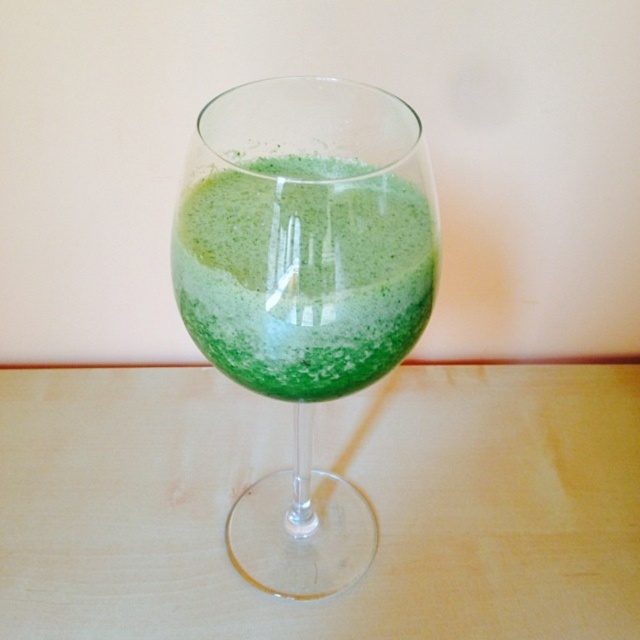
Question: Can you confirm if green glass at center is wider than green frothy liquid at center?

Choices:
 (A) yes
 (B) no

Answer: (A)

Question: Is green translucent wine glass at center thinner than green frothy liquid at center?

Choices:
 (A) no
 (B) yes

Answer: (A)

Question: Does green glass at center appear over green translucent wine glass at center?

Choices:
 (A) yes
 (B) no

Answer: (B)

Question: Which object is positioned farthest from the green frothy liquid at center?

Choices:
 (A) green glass at center
 (B) green translucent wine glass at center

Answer: (A)

Question: Among these points, which one is nearest to the camera?

Choices:
 (A) (305, 378)
 (B) (198, 243)

Answer: (B)

Question: Which point appears farthest from the camera in this image?

Choices:
 (A) (262, 388)
 (B) (330, 170)

Answer: (B)